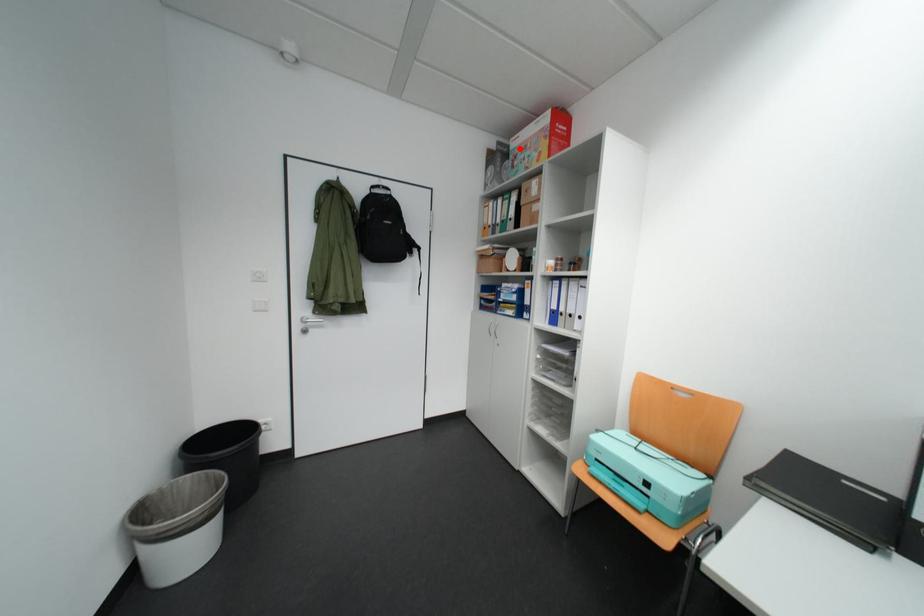
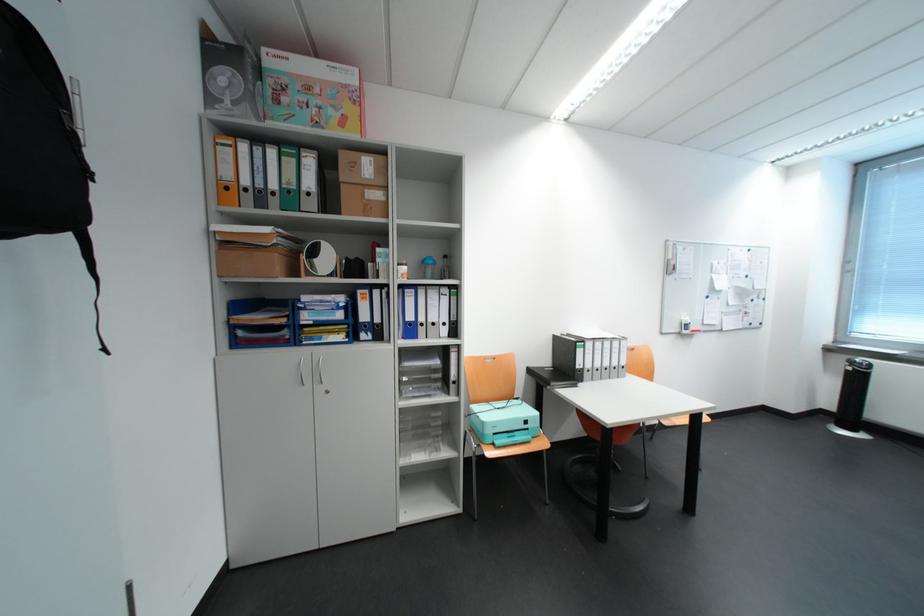
Question: I am providing you with two images of the same scene from different viewpoints. A red point is shown in image1. For the corresponding object point in image2, is it positioned nearer or farther from the camera?

Choices:
 (A) Nearer
 (B) Farther

Answer: (B)